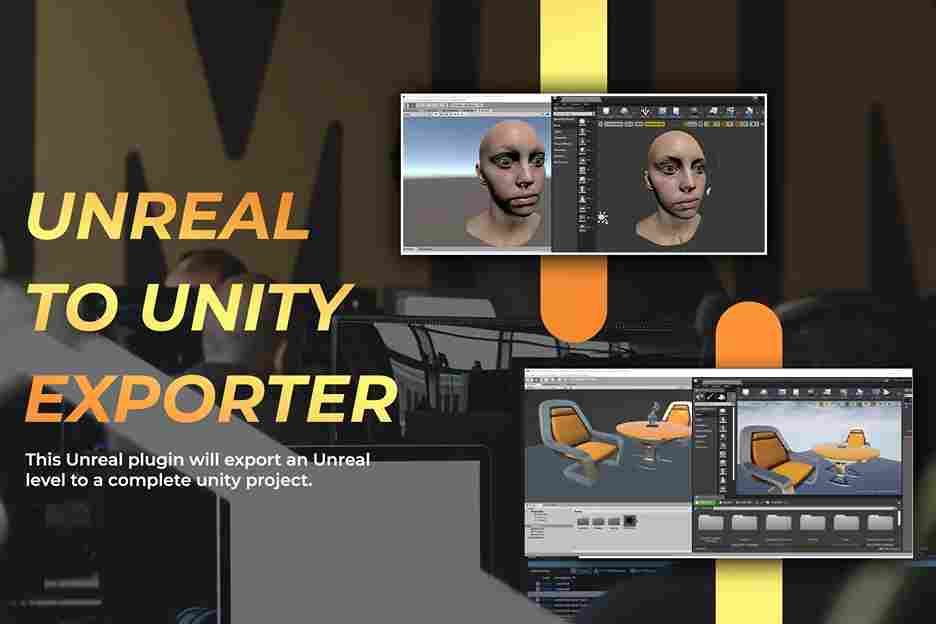
Identify the location of chair. coord(680,414), coord(857,436), coord(793,462), coord(583,444).